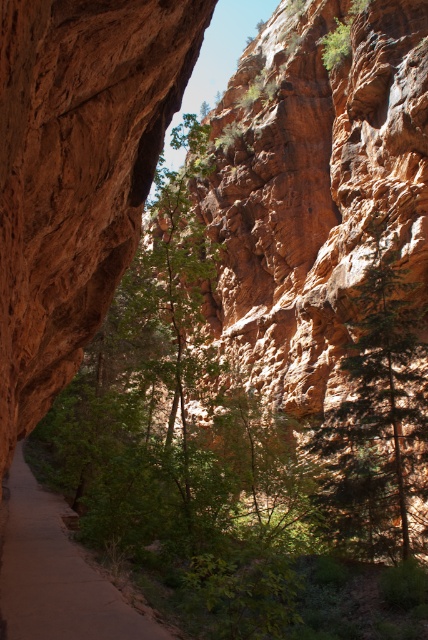
You are a hiker standing at the entrance of the canyon. You see the green textured tree at right and the smooth dirt path at center. Which object is taller?

The green textured tree at right is much taller than the smooth dirt path at center.

You are a hiker carrying a backpack and want to reach the green textured tree at right from the smooth dirt path at center. Given that the distance between them is 54.32 feet, can you estimate how many minutes it would take you to walk there at a leisurely pace?

The distance between the green textured tree at right and the smooth dirt path at center is 54.32 feet. At a leisurely walking pace of about 2.5 mph, it would take approximately 1 minute to cover this distance.

You are standing at the entrance of the canyon and see two points marked on the path. The first point is at coordinates point (309, 445) and the second is at point (82, 560). Which point is closer to you as you stand at the entrance?

Point (82, 560) is closer to you because it is in front of point 0.697, 0.622, which is further back along the path.